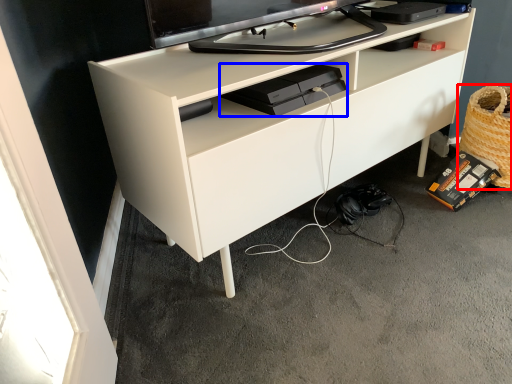
Question: Which of the following is the closest to the observer, basket (highlighted by a red box) or equipment (highlighted by a blue box)?

Choices:
 (A) basket
 (B) equipment

Answer: (B)